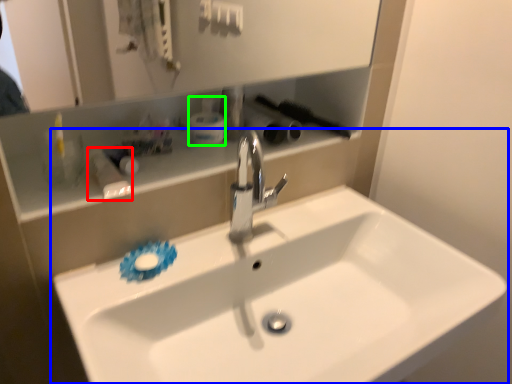
Question: Estimate the real-world distances between objects in this image. Which object is closer to toiletry (highlighted by a red box), sink (highlighted by a blue box) or toiletry (highlighted by a green box)?

Choices:
 (A) sink
 (B) toiletry

Answer: (B)